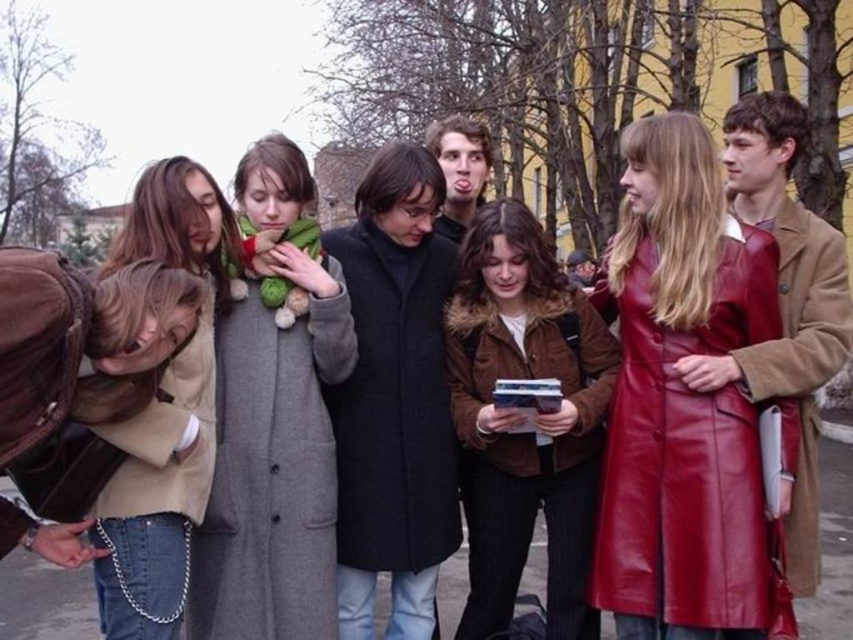
Can you confirm if shiny red leather coat at center is positioned below leather coat at right?

Indeed, shiny red leather coat at center is positioned under leather coat at right.

Can you confirm if shiny red leather coat at center is positioned to the right of leather coat at right?

No, shiny red leather coat at center is not to the right of leather coat at right.

Find the location of a particular element. Image resolution: width=853 pixels, height=640 pixels. shiny red leather coat at center is located at coordinates (682, 400).

You are a GUI agent. You are given a task and a screenshot of the screen. Output one action in this format:
    pyautogui.click(x=<x>, y=<y>)
    Task: Click on the shiny red leather coat at center
    The image size is (853, 640).
    Given the screenshot: What is the action you would take?
    (x=682, y=400)

Between shiny red leather coat at center and gray wool coat at center, which one appears on the right side from the viewer's perspective?

→ From the viewer's perspective, shiny red leather coat at center appears more on the right side.

Measure the distance between shiny red leather coat at center and gray wool coat at center.

shiny red leather coat at center and gray wool coat at center are 6.88 feet apart.

The width and height of the screenshot is (853, 640). What do you see at coordinates (682, 400) in the screenshot?
I see `shiny red leather coat at center` at bounding box center [682, 400].

Find the location of a particular element. This screenshot has width=853, height=640. shiny red leather coat at center is located at coordinates (682, 400).

Who is shorter, brown leather jacket at center or leather coat at right?

Standing shorter between the two is brown leather jacket at center.

Between point (497, 419) and point (810, 444), which one is positioned in front?

Point (497, 419) is in front.

Measure the distance between point (595,461) and camera.

They are 4.95 meters apart.

Identify the location of brown leather jacket at center. (x=525, y=420).